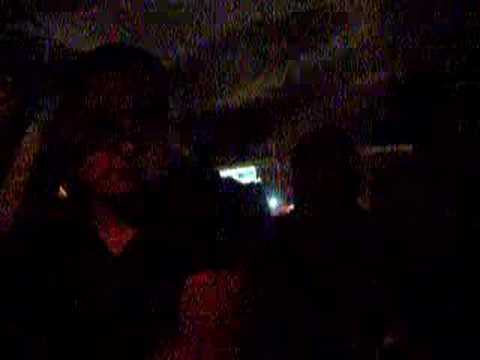
Where is `chest`? chest is located at coordinates (114, 261).